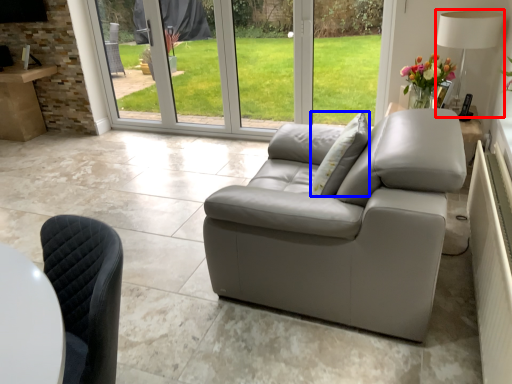
Question: Which object is closer to the camera taking this photo, lamp (highlighted by a red box) or pillow (highlighted by a blue box)?

Choices:
 (A) lamp
 (B) pillow

Answer: (B)